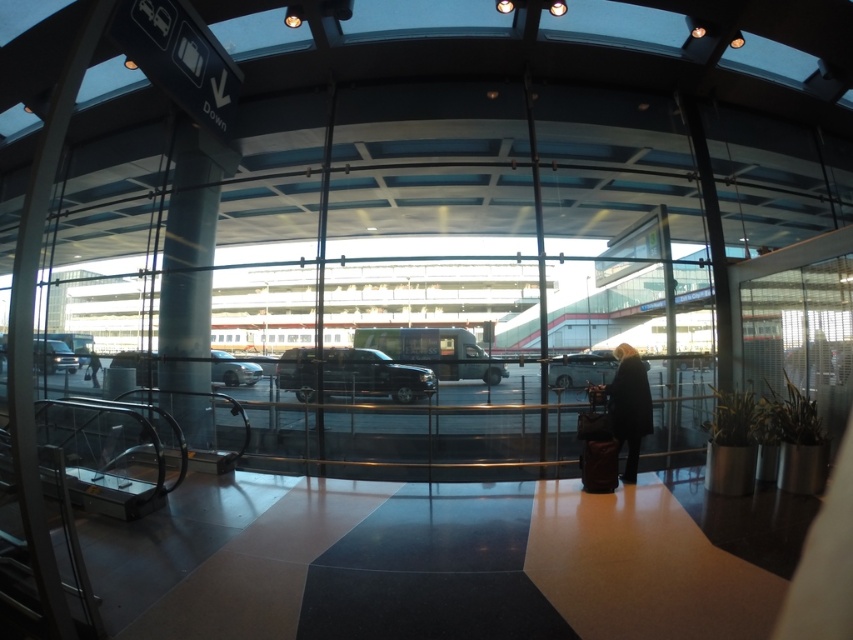
You are a traveler trying to find your luggage. You see a shiny silver sedan at center and a dark gray jacket at lower center. Which object is closer to you?

The dark gray jacket at lower center is closer to you because the shiny silver sedan at center is positioned under it, indicating it is behind.

You are a traveler looking at the scene. The shiny silver sedan at center and the dark gray jacket at lower center are both visible. Which object is positioned to the right of the other?

The shiny silver sedan at center is to the right of the dark gray jacket at lower center.